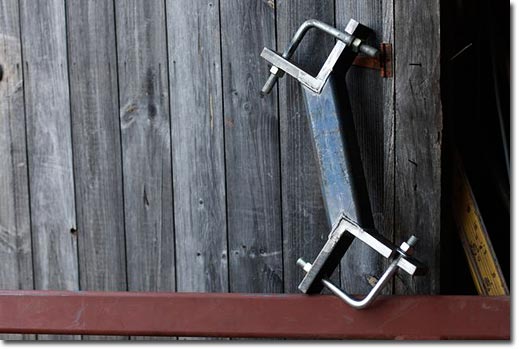
You are a GUI agent. You are given a task and a screenshot of the screen. Output one action in this format:
    pyautogui.click(x=<x>, y=<y>)
    Task: Click on the grey cable in open spot
    This screenshot has width=519, height=349.
    Given the screenshot: What is the action you would take?
    pyautogui.click(x=506, y=152), pyautogui.click(x=497, y=101)